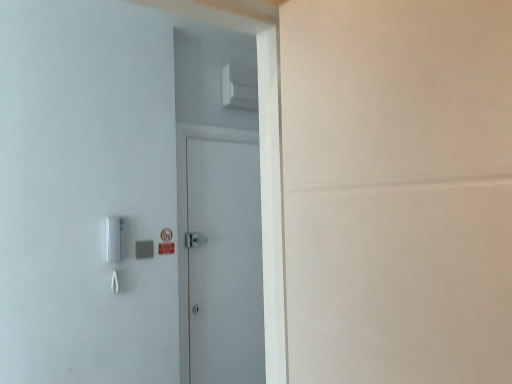
Question: Is point (152, 241) closer or farther from the camera than point (244, 251)?

Choices:
 (A) closer
 (B) farther

Answer: (A)

Question: Relative to white matte door at center, is gray matte/light switch at left in front or behind?

Choices:
 (A) behind
 (B) front

Answer: (B)

Question: In terms of width, does gray matte/light switch at left look wider or thinner when compared to white matte door at center?

Choices:
 (A) thin
 (B) wide

Answer: (A)

Question: Is white matte door at center bigger or smaller than gray matte/light switch at left?

Choices:
 (A) small
 (B) big

Answer: (B)

Question: Would you say white matte door at center is to the left or to the right of gray matte/light switch at left in the picture?

Choices:
 (A) left
 (B) right

Answer: (B)

Question: From the image's perspective, is white matte door at center positioned above or below gray matte/light switch at left?

Choices:
 (A) above
 (B) below

Answer: (B)

Question: Would you say white matte door at center is inside or outside gray matte/light switch at left?

Choices:
 (A) inside
 (B) outside

Answer: (B)